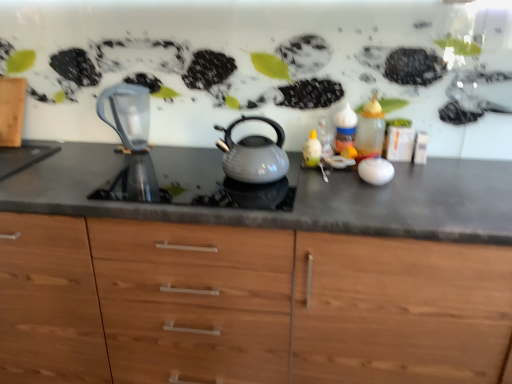
Question: Considering the relative sizes of matte gray kettle at center and transparent glass jug at left in the image provided, is matte gray kettle at center bigger than transparent glass jug at left?

Choices:
 (A) yes
 (B) no

Answer: (B)

Question: Is matte gray kettle at center smaller than transparent glass jug at left?

Choices:
 (A) yes
 (B) no

Answer: (A)

Question: From the image's perspective, is matte gray kettle at center beneath transparent glass jug at left?

Choices:
 (A) yes
 (B) no

Answer: (A)

Question: Is matte gray kettle at center beside transparent glass jug at left?

Choices:
 (A) yes
 (B) no

Answer: (B)

Question: From a real-world perspective, is matte gray kettle at center under transparent glass jug at left?

Choices:
 (A) no
 (B) yes

Answer: (B)

Question: From the image's perspective, is matte gray countertop at center above or below matte gray kettle at center?

Choices:
 (A) below
 (B) above

Answer: (A)

Question: Do you think matte gray countertop at center is within matte gray kettle at center, or outside of it?

Choices:
 (A) outside
 (B) inside

Answer: (A)

Question: Relative to matte gray kettle at center, is matte gray countertop at center in front or behind?

Choices:
 (A) behind
 (B) front

Answer: (B)

Question: From a real-world perspective, is matte gray countertop at center above or below matte gray kettle at center?

Choices:
 (A) above
 (B) below

Answer: (B)

Question: Is point (120, 119) positioned closer to the camera than point (241, 152)?

Choices:
 (A) closer
 (B) farther

Answer: (B)

Question: From the image's perspective, is transparent glass jug at left positioned above or below matte gray kettle at center?

Choices:
 (A) below
 (B) above

Answer: (B)

Question: In terms of height, does transparent glass jug at left look taller or shorter compared to matte gray kettle at center?

Choices:
 (A) tall
 (B) short

Answer: (A)

Question: From a real-world perspective, relative to matte gray kettle at center, is transparent glass jug at left vertically above or below?

Choices:
 (A) below
 (B) above

Answer: (B)

Question: Considering the positions of translucent glass bottle at right and matte gray countertop at center in the image, is translucent glass bottle at right taller or shorter than matte gray countertop at center?

Choices:
 (A) tall
 (B) short

Answer: (B)

Question: Considering the positions of point (382, 139) and point (445, 329), is point (382, 139) closer or farther from the camera than point (445, 329)?

Choices:
 (A) farther
 (B) closer

Answer: (A)